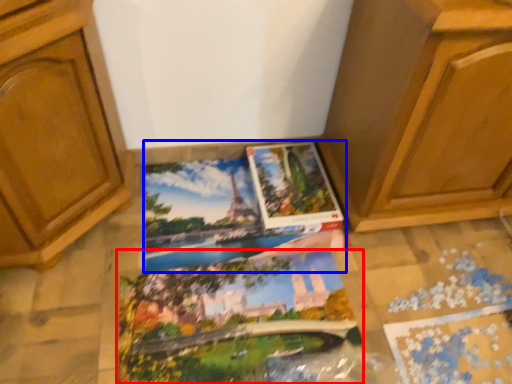
Question: Among these objects, which one is farthest to the camera, coloring book (highlighted by a red box) or coloring book (highlighted by a blue box)?

Choices:
 (A) coloring book
 (B) coloring book

Answer: (B)